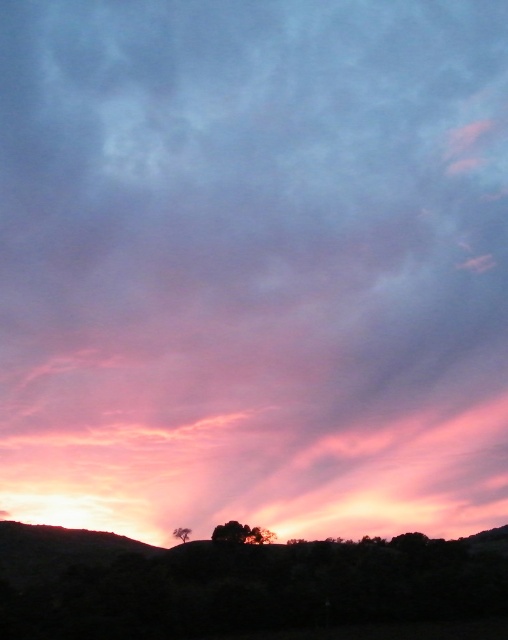
Looking at this image, does dark brown textured hillside at lower center have a greater height compared to silhouetted tree at lower center?

Indeed, dark brown textured hillside at lower center has a greater height compared to silhouetted tree at lower center.

Can you confirm if dark brown textured hillside at lower center is positioned above silhouetted tree at lower center?

Actually, dark brown textured hillside at lower center is below silhouetted tree at lower center.

Measure the distance between dark brown textured hillside at lower center and camera.

dark brown textured hillside at lower center is 123.01 feet from camera.

At what (x,y) coordinates should I click in order to perform the action: click on dark brown textured hillside at lower center. Please return your answer as a coordinate pair (x, y). This screenshot has height=640, width=508. Looking at the image, I should click on (239, 584).

Can you confirm if silhouetted tree at lower center is positioned above smooth brown tree at lower center?

Indeed, silhouetted tree at lower center is positioned over smooth brown tree at lower center.

Can you confirm if silhouetted tree at lower center is bigger than smooth brown tree at lower center?

Indeed, silhouetted tree at lower center has a larger size compared to smooth brown tree at lower center.

Is point (240, 529) less distant than point (190, 531)?

Yes, it is.

This screenshot has width=508, height=640. Identify the location of silhouetted tree at lower center. (241, 532).

This screenshot has height=640, width=508. Describe the element at coordinates (239, 584) in the screenshot. I see `dark brown textured hillside at lower center` at that location.

From the picture: Measure the distance between point (136, 608) and camera.

Point (136, 608) is 128.72 feet from camera.

Which is in front, point (147, 564) or point (180, 536)?

Point (147, 564)

At what (x,y) coordinates should I click in order to perform the action: click on dark brown textured hillside at lower center. Please return your answer as a coordinate pair (x, y). Looking at the image, I should click on (239, 584).